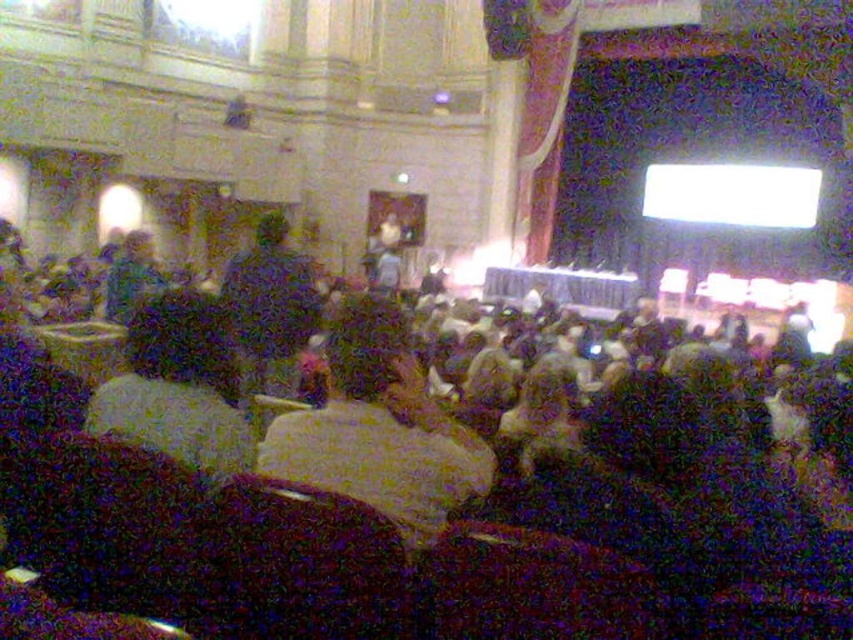
Is point (424, 500) closer to camera compared to point (111, 298)?

Yes.

Between light brown fabric chair at center and fluffy beige sweater at center, which one is positioned lower?

light brown fabric chair at center

Where is `light brown fabric chair at center`? This screenshot has width=853, height=640. light brown fabric chair at center is located at coordinates (379, 428).

Where is `light brown fabric chair at center`? Image resolution: width=853 pixels, height=640 pixels. light brown fabric chair at center is located at coordinates (379, 428).

Is point (302, 339) in front of point (155, 282)?

Yes.

Can you confirm if dark blue shirt at center is taller than fluffy beige sweater at center?

Yes.

Who is more distant from viewer, (263, 257) or (140, 250)?

The point (140, 250) is more distant.

The image size is (853, 640). Find the location of `dark blue shirt at center`. dark blue shirt at center is located at coordinates (271, 307).

Is dark brown leather jacket at center thinner than dark blue shirt at center?

No.

How much distance is there between dark brown leather jacket at center and dark blue shirt at center?

dark brown leather jacket at center is 8.61 meters from dark blue shirt at center.

Where is `dark brown leather jacket at center`? The height and width of the screenshot is (640, 853). dark brown leather jacket at center is located at coordinates (178, 387).